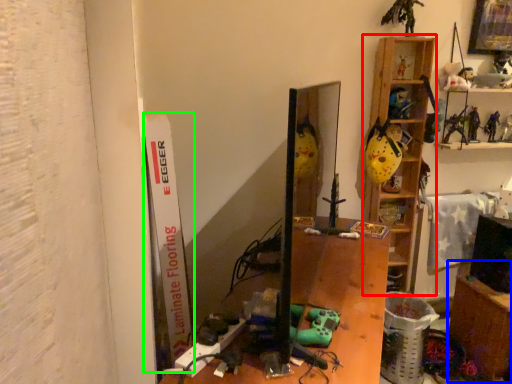
Question: Which object is positioned closest to shelf (highlighted by a red box)? Select from table (highlighted by a blue box) and bulletin board (highlighted by a green box).

Choices:
 (A) table
 (B) bulletin board

Answer: (A)